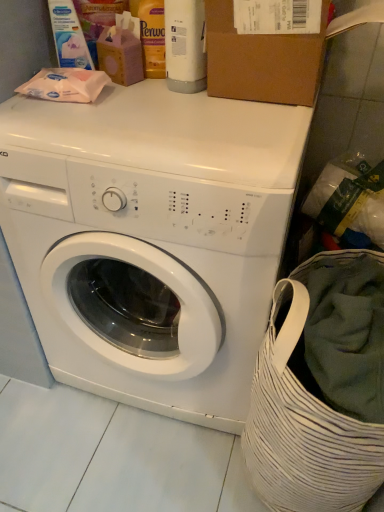
Question: Is brown cardboard box at upper center facing towards white matte washing machine at center?

Choices:
 (A) yes
 (B) no

Answer: (B)

Question: Considering the relative sizes of brown cardboard box at upper center and white matte washing machine at center in the image provided, is brown cardboard box at upper center bigger than white matte washing machine at center?

Choices:
 (A) yes
 (B) no

Answer: (B)

Question: From the image's perspective, would you say brown cardboard box at upper center is positioned over white matte washing machine at center?

Choices:
 (A) no
 (B) yes

Answer: (B)

Question: Can white matte washing machine at center be found inside brown cardboard box at upper center?

Choices:
 (A) no
 (B) yes

Answer: (A)

Question: Considering the relative sizes of brown cardboard box at upper center and white matte washing machine at center in the image provided, is brown cardboard box at upper center thinner than white matte washing machine at center?

Choices:
 (A) yes
 (B) no

Answer: (A)

Question: Would you say brown cardboard box at upper center is a long distance from white matte washing machine at center?

Choices:
 (A) yes
 (B) no

Answer: (B)

Question: Is white glossy bottle at upper center, acting as the 1th cleaning product starting from the right, oriented towards matte white wipes at upper left, the first cleaning product viewed from the left?

Choices:
 (A) no
 (B) yes

Answer: (A)

Question: Would you say white glossy bottle at upper center, acting as the second cleaning product starting from the left, is outside matte white wipes at upper left, which is counted as the second cleaning product, starting from the right?

Choices:
 (A) no
 (B) yes

Answer: (B)

Question: Is white glossy bottle at upper center, acting as the 1th cleaning product starting from the right, facing away from matte white wipes at upper left, which is counted as the second cleaning product, starting from the right?

Choices:
 (A) yes
 (B) no

Answer: (B)

Question: Considering the relative sizes of white glossy bottle at upper center, acting as the second cleaning product starting from the left, and matte white wipes at upper left, the first cleaning product viewed from the left, in the image provided, is white glossy bottle at upper center, acting as the second cleaning product starting from the left, shorter than matte white wipes at upper left, the first cleaning product viewed from the left,?

Choices:
 (A) no
 (B) yes

Answer: (A)

Question: Is white glossy bottle at upper center, acting as the 1th cleaning product starting from the right, bigger than matte white wipes at upper left, which is counted as the second cleaning product, starting from the right?

Choices:
 (A) yes
 (B) no

Answer: (A)

Question: Considering the relative sizes of white glossy bottle at upper center, acting as the 1th cleaning product starting from the right, and matte white wipes at upper left, which is counted as the second cleaning product, starting from the right, in the image provided, is white glossy bottle at upper center, acting as the 1th cleaning product starting from the right, thinner than matte white wipes at upper left, which is counted as the second cleaning product, starting from the right,?

Choices:
 (A) yes
 (B) no

Answer: (B)

Question: From a real-world perspective, is matte white wipes at upper left, which is counted as the second cleaning product, starting from the right, over brown cardboard box at upper center?

Choices:
 (A) no
 (B) yes

Answer: (B)